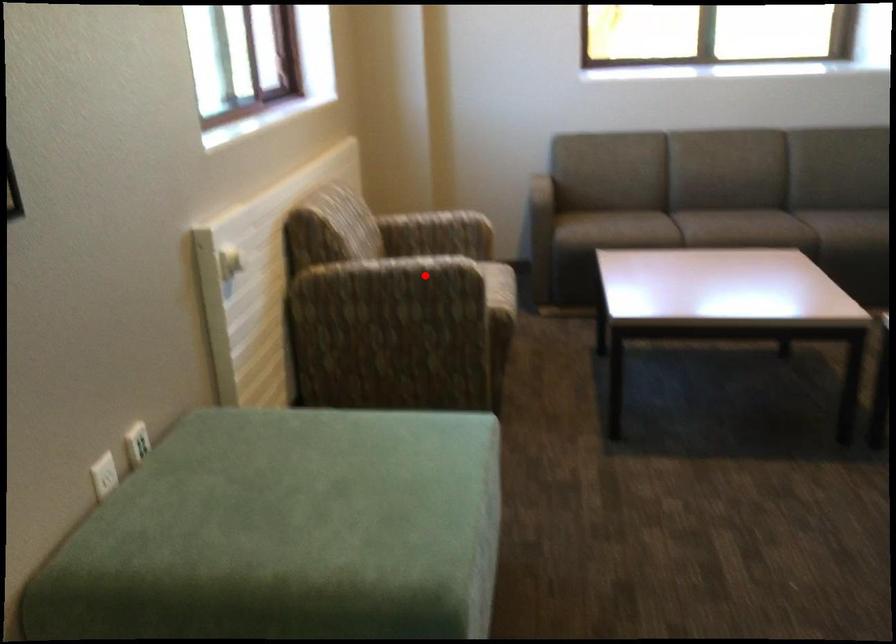
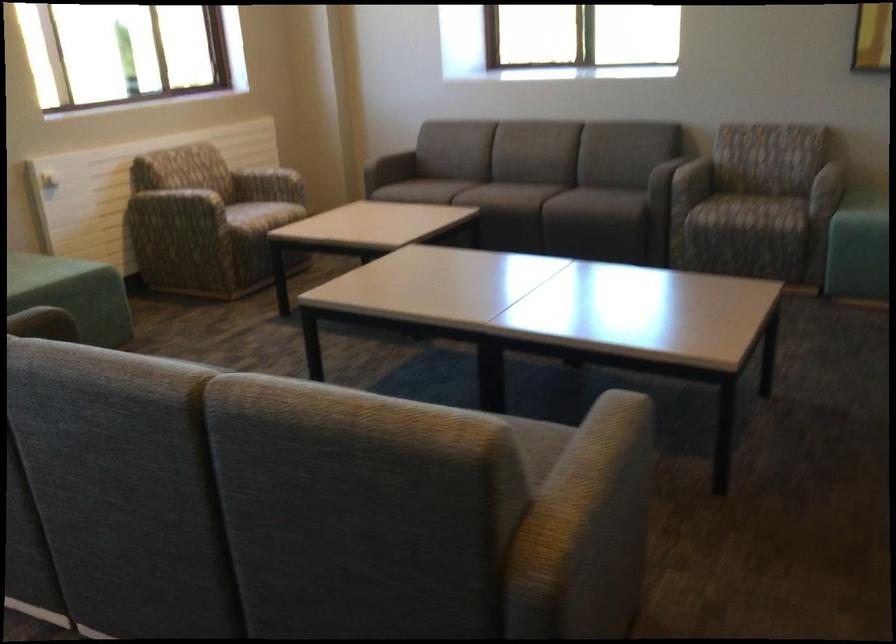
Question: A red point is marked in image1. In image2, is the corresponding 3D point closer to the camera or farther? Reply with the corresponding letter.

Choices:
 (A) The corresponding 3D point is closer.
 (B) The corresponding 3D point is farther.

Answer: (B)